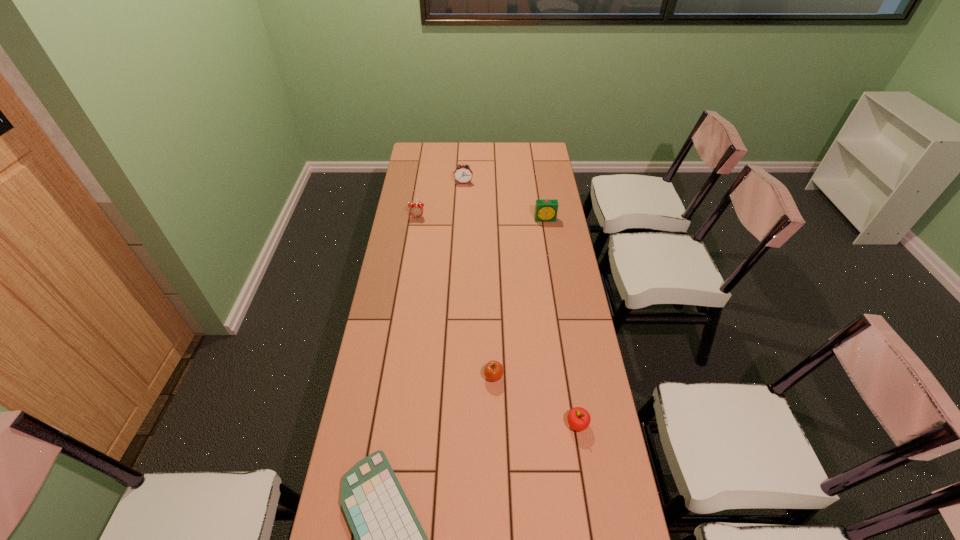
Find the location of a particular element. Image resolution: width=960 pixels, height=540 pixels. free space located 0.070m on the face of the leftmost alarm clock is located at coordinates (416, 229).

You are a GUI agent. You are given a task and a screenshot of the screen. Output one action in this format:
    pyautogui.click(x=<x>, y=<y>)
    Task: Click on the vacant space situated 0.060m on the back of the farther apple
    The height and width of the screenshot is (540, 960).
    Given the screenshot: What is the action you would take?
    pyautogui.click(x=492, y=353)

Locate an element on the screen. The image size is (960, 540). vacant area located on the left of the right apple is located at coordinates (510, 424).

You are a GUI agent. You are given a task and a screenshot of the screen. Output one action in this format:
    pyautogui.click(x=<x>, y=<y>)
    Task: Click on the object that is at the left edge
    The image size is (960, 540).
    Given the screenshot: What is the action you would take?
    pyautogui.click(x=416, y=210)

Identify the location of alarm clock located in the right edge section of the desktop. click(x=546, y=210).

What are the coordinates of `apple that is at the right edge` in the screenshot? It's located at (578, 418).

Locate an element on the screen. This screenshot has width=960, height=540. vacant space at the far edge of the desktop is located at coordinates (509, 163).

You are a GUI agent. You are given a task and a screenshot of the screen. Output one action in this format:
    pyautogui.click(x=<x>, y=<y>)
    Task: Click on the vacant space at the right edge of the desktop
    
    Given the screenshot: What is the action you would take?
    pyautogui.click(x=528, y=191)

Where is `free space at the far left corner of the desktop`? The image size is (960, 540). free space at the far left corner of the desktop is located at coordinates (428, 145).

Identify the location of vacant area between the third nearest object and the farthest object. (478, 280).